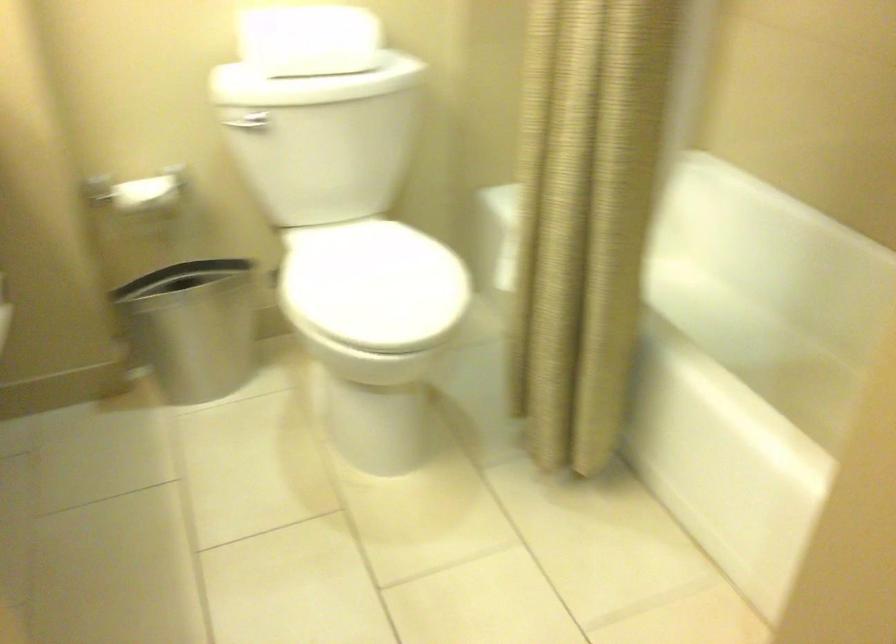
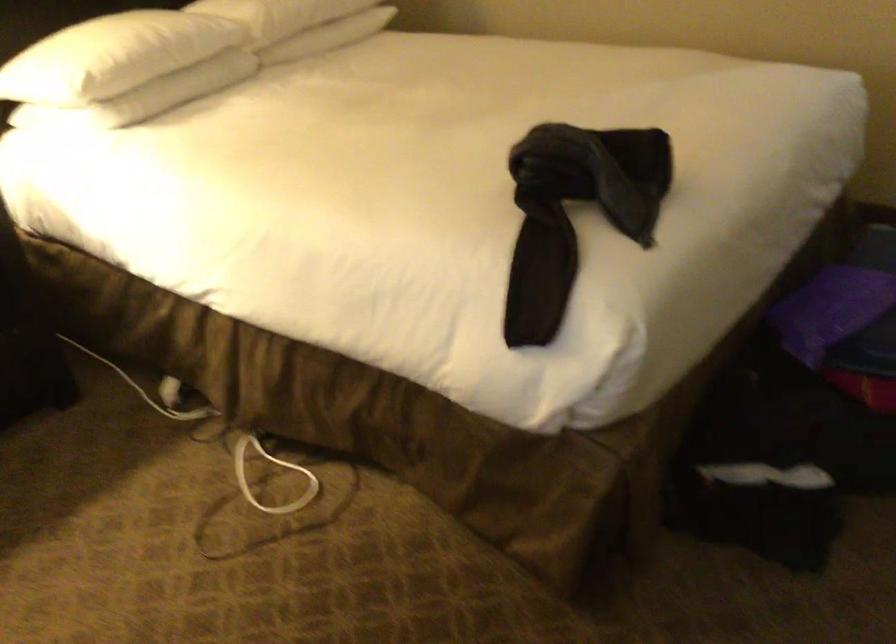
Question: I am providing you with two images of the same scene from different viewpoints. After the viewpoint changes to image2, which objects are now occluded?

Choices:
 (A) metal trash can
 (B) white pillow
 (C) small orange vase
 (D) white electrical cord

Answer: (A)